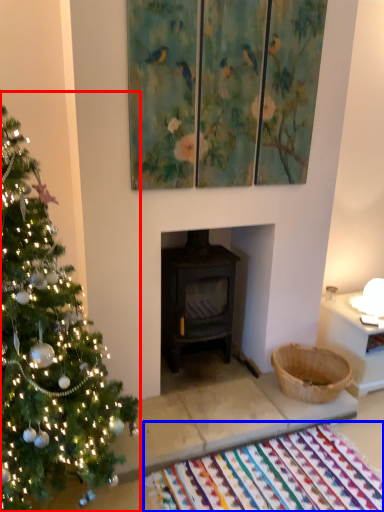
Question: Which object is closer to the camera taking this photo, christmas tree (highlighted by a red box) or mat (highlighted by a blue box)?

Choices:
 (A) christmas tree
 (B) mat

Answer: (A)